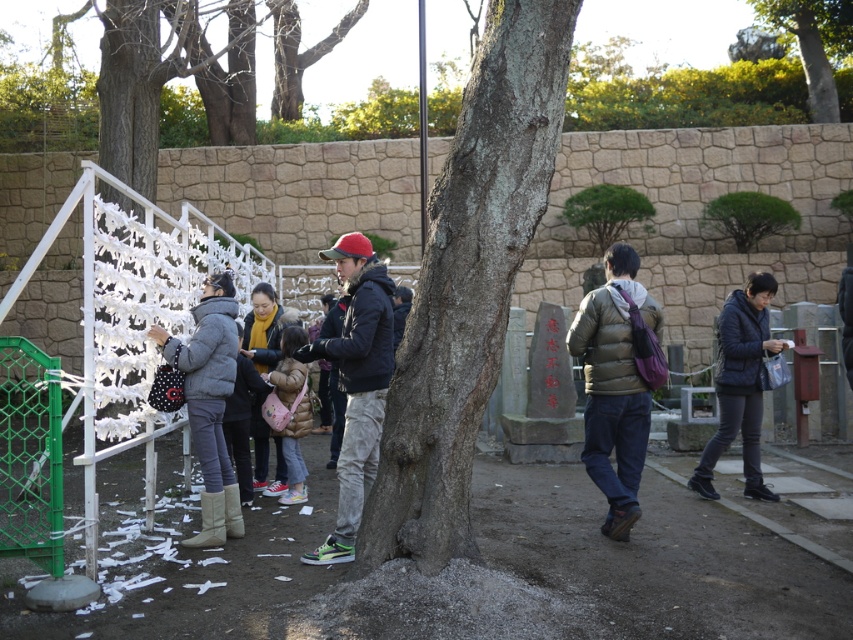
Question: Which point is farther to the camera?

Choices:
 (A) dark blue jacket at center
 (B) matte green jacket at center right

Answer: (B)

Question: Does dark blue jacket at center have a smaller size compared to green textured tree at upper right?

Choices:
 (A) yes
 (B) no

Answer: (A)

Question: Which point is closer to the camera?

Choices:
 (A) (608, 474)
 (B) (769, 340)
 (C) (292, 481)

Answer: (A)

Question: Is smooth brown bark at center above dark blue jacket at center?

Choices:
 (A) yes
 (B) no

Answer: (A)

Question: Can you confirm if matte green jacket at center right is bigger than matte pink fabric bag at center?

Choices:
 (A) yes
 (B) no

Answer: (A)

Question: Which object appears farthest from the camera in this image?

Choices:
 (A) gray woolen coat at left
 (B) smooth brown bark at center
 (C) green textured tree at upper right
 (D) dark blue quilted jacket at lower right

Answer: (C)